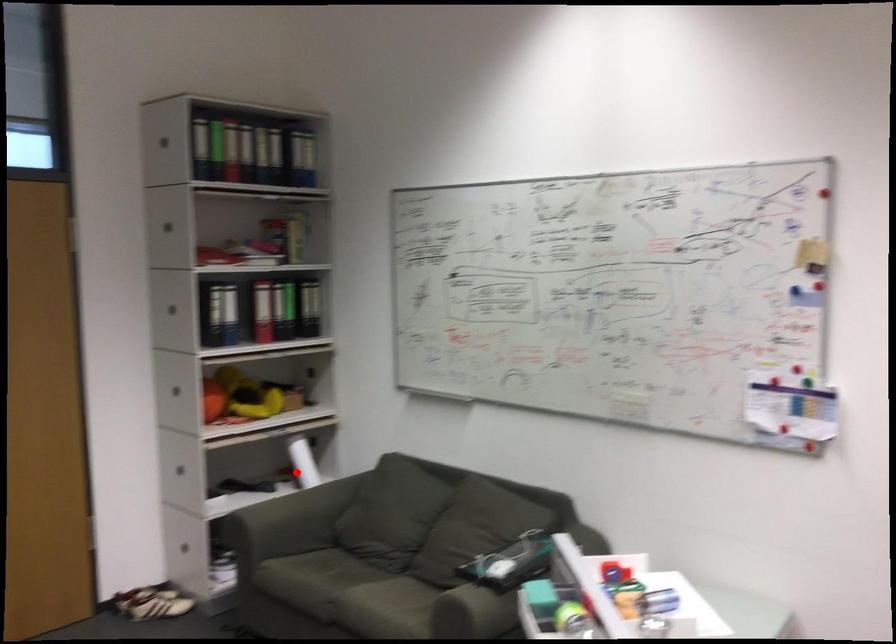
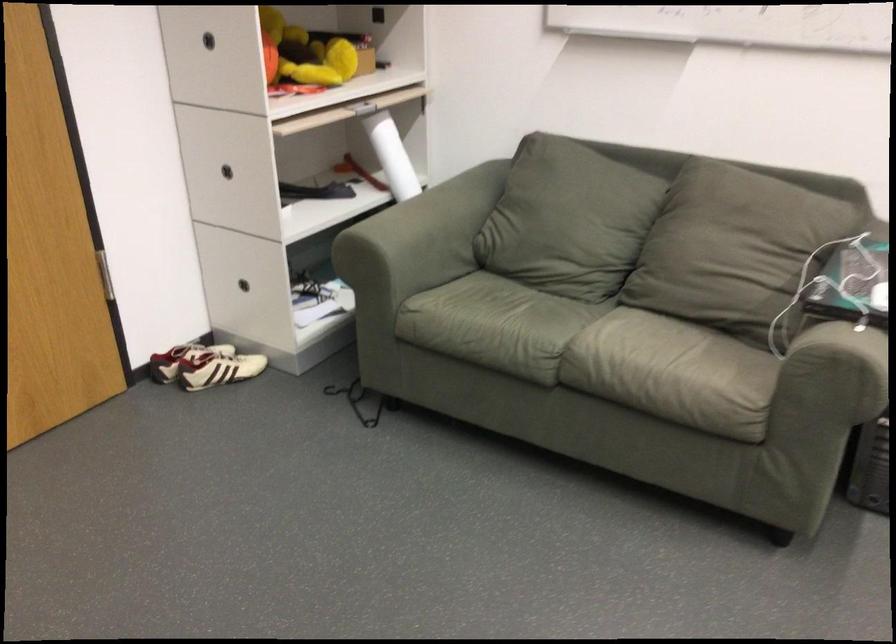
Question: A red point is marked in image1. In image2, is the corresponding 3D point closer to the camera or farther? Reply with the corresponding letter.

Choices:
 (A) The corresponding 3D point is closer.
 (B) The corresponding 3D point is farther.

Answer: (A)